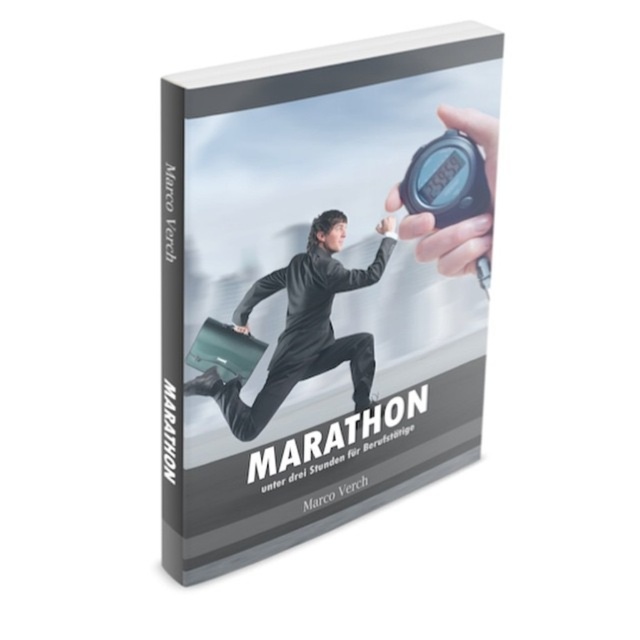
Based on the photo, does matte black book at center have a greater width compared to black matte suit at center?

Yes.

Between matte black book at center and black matte suit at center, which one appears on the right side from the viewer's perspective?

matte black book at center is more to the right.

Which is behind, point (173, 436) or point (328, 252)?

The point (328, 252) is more distant.

In order to click on matte black book at center in this screenshot , I will do `click(308, 294)`.

Can you confirm if black matte suit at center is positioned below black plastic stopwatch at upper right?

Correct, black matte suit at center is located below black plastic stopwatch at upper right.

Is point (252, 285) positioned after point (468, 224)?

No, it is in front of (468, 224).

You are a GUI agent. You are given a task and a screenshot of the screen. Output one action in this format:
    pyautogui.click(x=<x>, y=<y>)
    Task: Click on the black matte suit at center
    The image size is (640, 640).
    Given the screenshot: What is the action you would take?
    pyautogui.click(x=301, y=326)

Based on the photo, between matte black book at center and black plastic stopwatch at upper right, which one is positioned lower?

Result: Positioned lower is matte black book at center.

The width and height of the screenshot is (640, 640). In order to click on matte black book at center in this screenshot , I will do `click(308, 294)`.